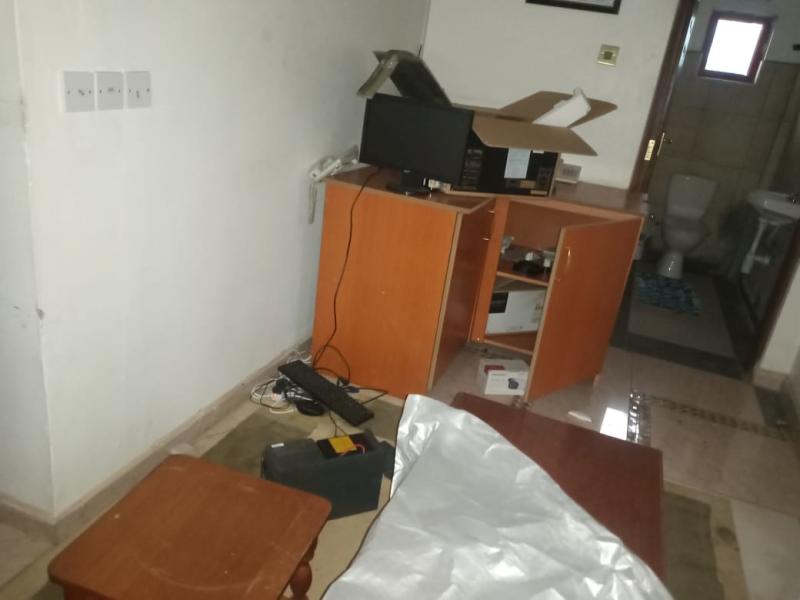
Image resolution: width=800 pixels, height=600 pixels. Identify the location of doors. (574, 291), (466, 283).